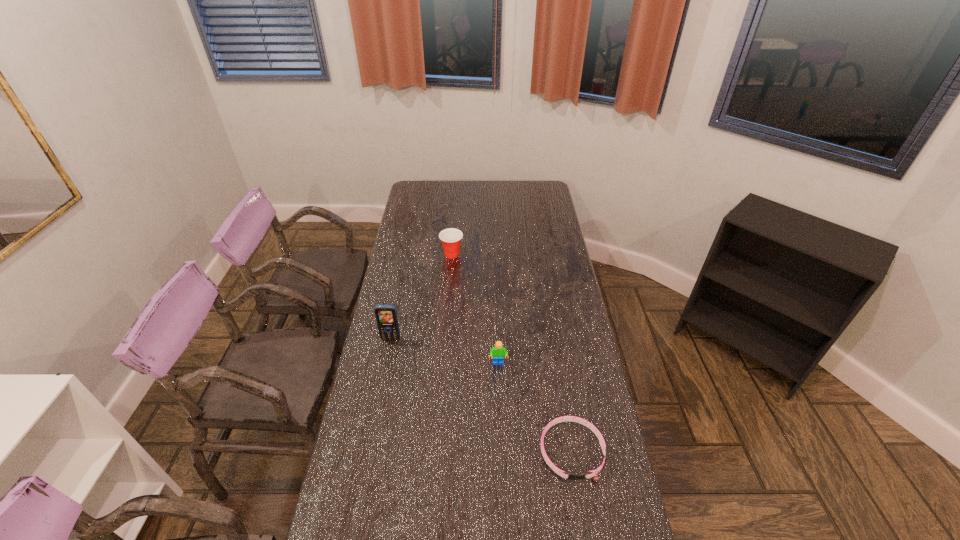
At what (x,y) coordinates should I click in order to perform the action: click on object identified as the second closest to the shortest object. Please return your answer as a coordinate pair (x, y). The width and height of the screenshot is (960, 540). Looking at the image, I should click on (386, 315).